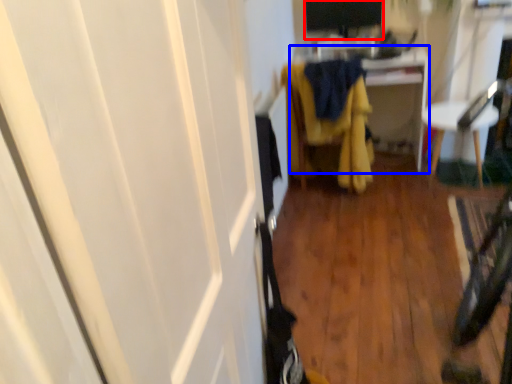
Question: Which object appears farthest to the camera in this image, computer monitor (highlighted by a red box) or cabinetry (highlighted by a blue box)?

Choices:
 (A) computer monitor
 (B) cabinetry

Answer: (A)